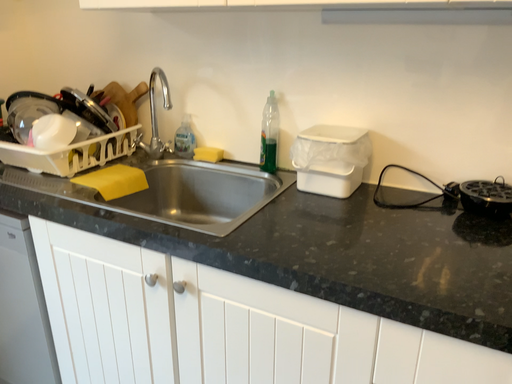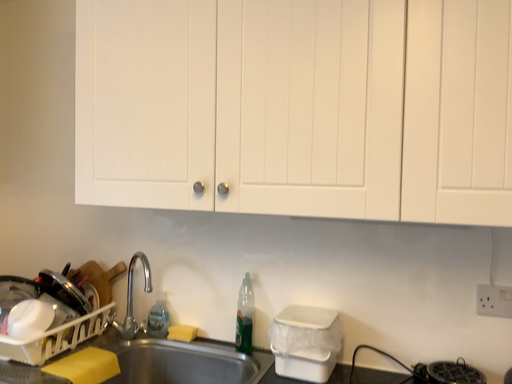
Question: Which way did the camera rotate in the video?

Choices:
 (A) rotated downward
 (B) rotated upward

Answer: (B)